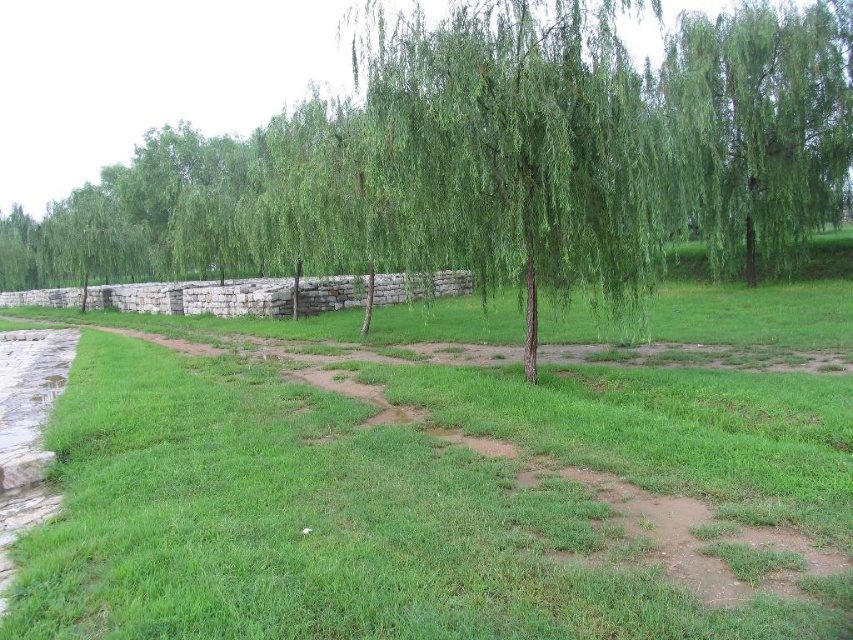
You are standing on the dirt path in the park and see two trees. The first is the green leafy tree at center, and the second is the green leafy willow at upper right. Which tree do you see higher in the image?

The green leafy tree at center is higher in the image than the green leafy willow at upper right.